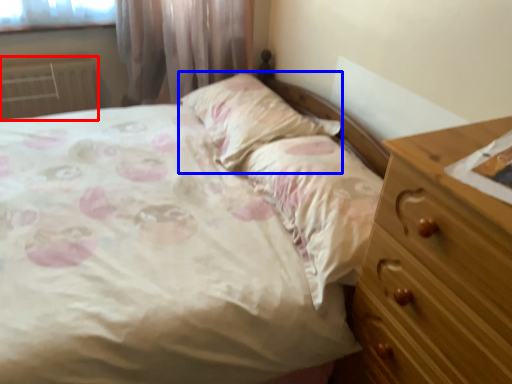
Question: Which object appears farthest to the camera in this image, radiator (highlighted by a red box) or pillow (highlighted by a blue box)?

Choices:
 (A) radiator
 (B) pillow

Answer: (A)